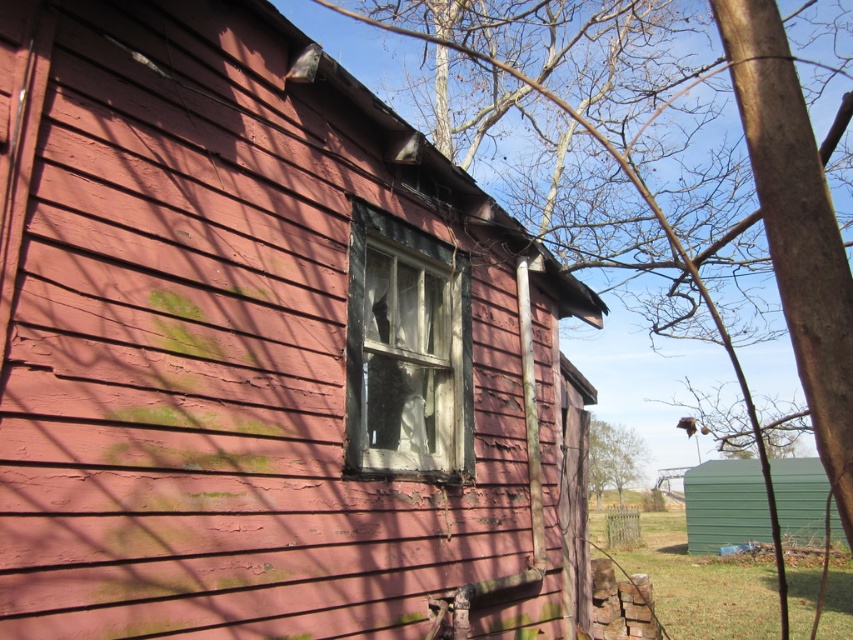
Question: Which of these objects is positioned farthest from the green corrugated metal hut at lower right?

Choices:
 (A) bare wood tree at center
 (B) green leafy tree at center
 (C) transparent glass window at center
 (D) peeling paint wooden hut at center

Answer: (C)

Question: Which point is closer to the camera?

Choices:
 (A) (154, 621)
 (B) (589, 444)
 (C) (495, 61)
 (D) (815, 531)

Answer: (A)

Question: Where is peeling paint wooden hut at center located in relation to green corrugated metal hut at lower right in the image?

Choices:
 (A) above
 (B) below

Answer: (A)

Question: Can you confirm if bare wood tree at center is positioned above green leafy tree at center?

Choices:
 (A) yes
 (B) no

Answer: (A)

Question: Which of the following is the closest to the observer?

Choices:
 (A) (360, 308)
 (B) (605, 442)

Answer: (A)

Question: Does peeling paint wooden hut at center have a lesser width compared to green leafy tree at center?

Choices:
 (A) no
 (B) yes

Answer: (B)